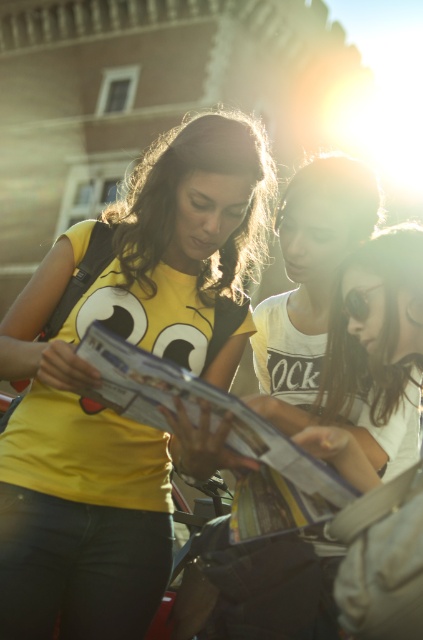
From the picture: Can you confirm if yellow matte t-shirt at center is wider than printed paper magazine at center?

Yes.

Between yellow matte t-shirt at center and printed paper magazine at center, which one has less height?

printed paper magazine at center

In order to click on yellow matte t-shirt at center in this screenshot , I will do `click(98, 378)`.

Which of these two, white matte shirt at center or printed paper magazine at center, stands shorter?

Standing shorter between the two is printed paper magazine at center.

At what (x,y) coordinates should I click in order to perform the action: click on white matte shirt at center. Please return your answer as a coordinate pair (x, y). The width and height of the screenshot is (423, 640). Looking at the image, I should click on (308, 285).

Identify the location of white matte shirt at center. This screenshot has width=423, height=640. (308, 285).

Can you confirm if yellow matte t-shirt at center is bigger than white matte shirt at center?

Yes, yellow matte t-shirt at center is bigger than white matte shirt at center.

Find the location of a particular element. The height and width of the screenshot is (640, 423). yellow matte t-shirt at center is located at coordinates (98, 378).

In order to click on yellow matte t-shirt at center in this screenshot , I will do `click(98, 378)`.

Identify the location of yellow matte t-shirt at center. (98, 378).